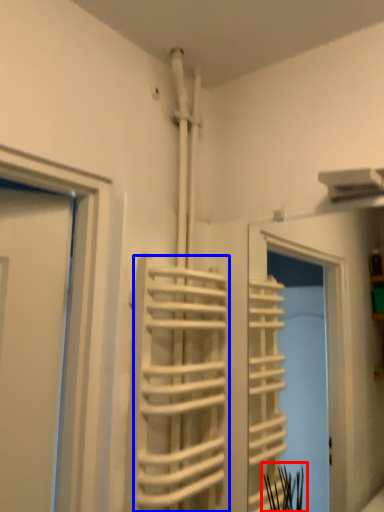
Question: Which point is further to the camera, plant (highlighted by a red box) or stair (highlighted by a blue box)?

Choices:
 (A) plant
 (B) stair

Answer: (A)